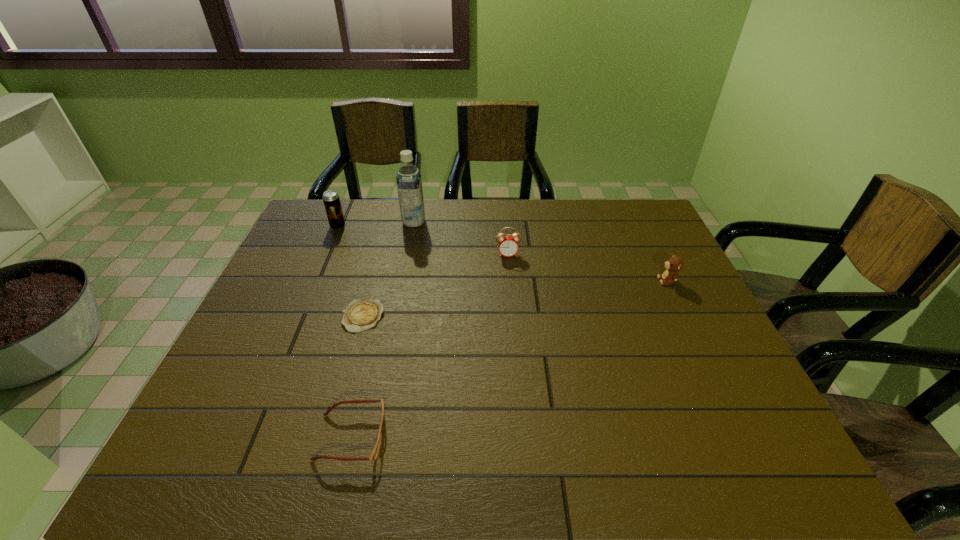
The height and width of the screenshot is (540, 960). I want to click on soya milk, so pos(409,182).

Where is `beer can`? This screenshot has width=960, height=540. beer can is located at coordinates (331, 199).

Where is `the leftmost object`? The width and height of the screenshot is (960, 540). the leftmost object is located at coordinates (331, 199).

Identify the location of alarm clock. Image resolution: width=960 pixels, height=540 pixels. (508, 245).

Identify the location of the third farthest object. The height and width of the screenshot is (540, 960). (508, 245).

Identify the location of teddy bear. (674, 264).

The height and width of the screenshot is (540, 960). What are the coordinates of `the rightmost object` in the screenshot? It's located at (674, 264).

The image size is (960, 540). I want to click on the nearest object, so (x=374, y=454).

The height and width of the screenshot is (540, 960). I want to click on spectacles, so click(374, 454).

Locate an element on the screen. the shortest object is located at coordinates (362, 314).